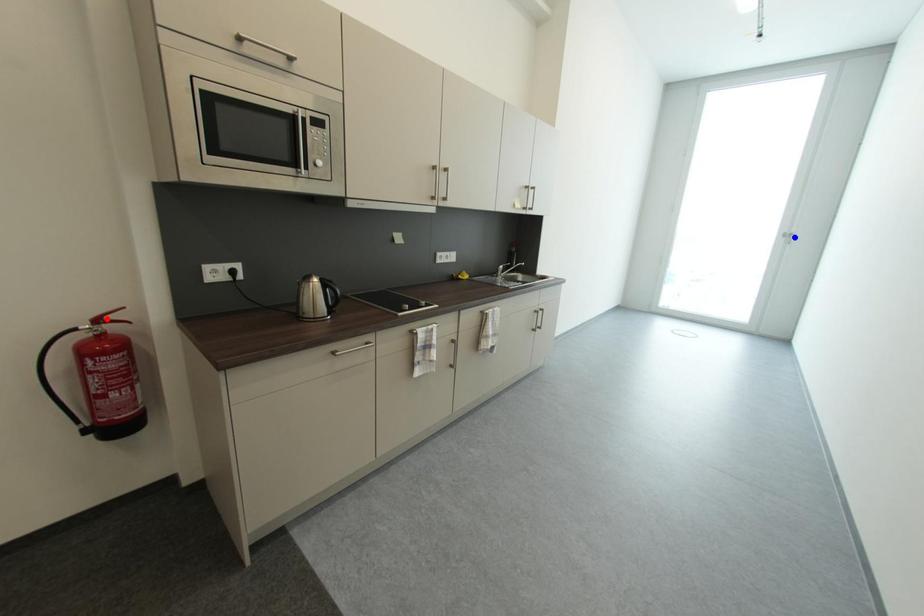
Question: In the image, two points are highlighted. Which point is nearer to the camera? Reply with the corresponding letter.

Choices:
 (A) blue point
 (B) red point

Answer: (B)